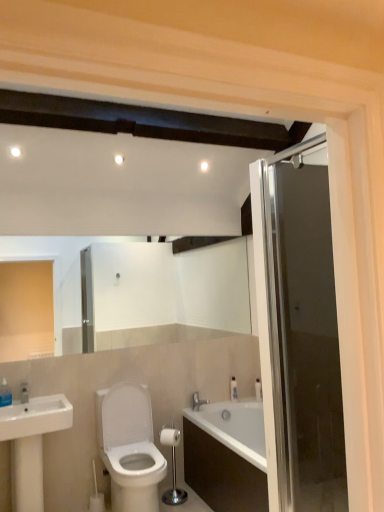
Question: Does transparent glass door at right appear on the left side of white matte toilet paper at center?

Choices:
 (A) no
 (B) yes

Answer: (A)

Question: Is transparent glass door at right bigger than white matte toilet paper at center?

Choices:
 (A) no
 (B) yes

Answer: (B)

Question: Considering the relative sizes of transparent glass door at right and white matte toilet paper at center in the image provided, is transparent glass door at right shorter than white matte toilet paper at center?

Choices:
 (A) no
 (B) yes

Answer: (A)

Question: From a real-world perspective, is transparent glass door at right positioned under white matte toilet paper at center based on gravity?

Choices:
 (A) yes
 (B) no

Answer: (B)

Question: Are transparent glass door at right and white matte toilet paper at center located far from each other?

Choices:
 (A) yes
 (B) no

Answer: (A)

Question: Is white glossy toilet at center inside the boundaries of silver metallic faucet at lower center, or outside?

Choices:
 (A) outside
 (B) inside

Answer: (A)

Question: Is white glossy toilet at center taller or shorter than silver metallic faucet at lower center?

Choices:
 (A) short
 (B) tall

Answer: (B)

Question: From the image's perspective, relative to silver metallic faucet at lower center, is white glossy toilet at center above or below?

Choices:
 (A) above
 (B) below

Answer: (B)

Question: In terms of size, does white glossy toilet at center appear bigger or smaller than silver metallic faucet at lower center?

Choices:
 (A) big
 (B) small

Answer: (A)

Question: From the image's perspective, relative to silver metallic faucet at lower center, is silver metallic toilet paper holder at center above or below?

Choices:
 (A) above
 (B) below

Answer: (B)

Question: In terms of size, does silver metallic toilet paper holder at center appear bigger or smaller than silver metallic faucet at lower center?

Choices:
 (A) big
 (B) small

Answer: (A)

Question: From a real-world perspective, is silver metallic toilet paper holder at center positioned above or below silver metallic faucet at lower center?

Choices:
 (A) below
 (B) above

Answer: (A)

Question: From their relative heights in the image, would you say silver metallic toilet paper holder at center is taller or shorter than silver metallic faucet at lower center?

Choices:
 (A) tall
 (B) short

Answer: (A)

Question: From a real-world perspective, is silver metallic faucet at lower center above or below transparent glass door at right?

Choices:
 (A) below
 (B) above

Answer: (A)

Question: In terms of size, does silver metallic faucet at lower center appear bigger or smaller than transparent glass door at right?

Choices:
 (A) small
 (B) big

Answer: (A)